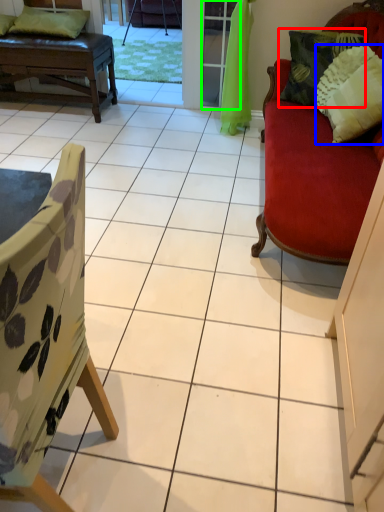
Question: Which object is positioned closest to pillow (highlighted by a red box)? Select from pillow (highlighted by a blue box) and screen door (highlighted by a green box).

Choices:
 (A) pillow
 (B) screen door

Answer: (A)